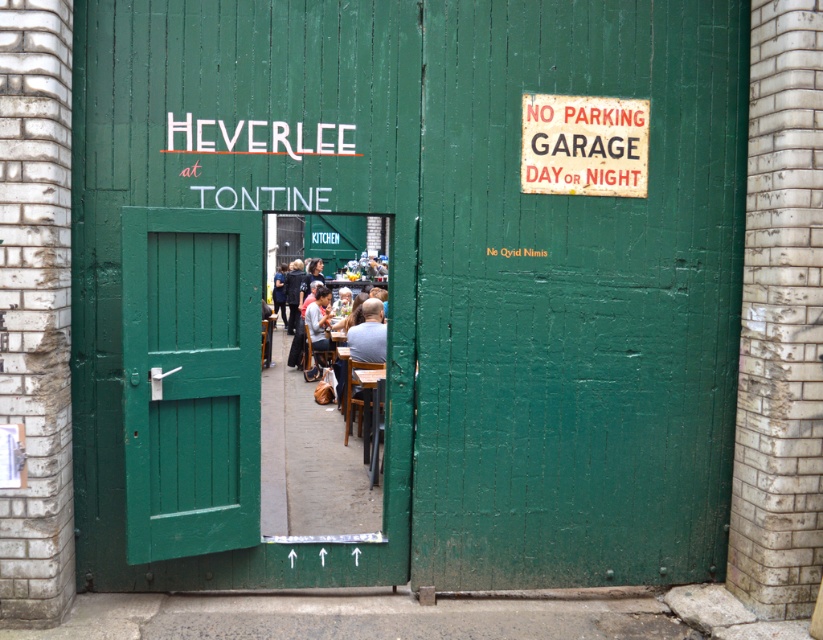
You are standing in front of the green wooden door at center and want to read the metallic rectangular sign at upper right. Which direction should you move to face the sign?

The green wooden door at center is positioned on the left side of the metallic rectangular sign at upper right, so you should move to your right to face the sign.

Consider the image. You are standing outside the green wooden door at center and want to enter the building. However, there is a metallic rectangular sign at upper right nearby. Can you walk straight towards the door without passing by the sign?

The green wooden door at center is in front of the metallic rectangular sign at upper right, meaning the sign is behind the door from your perspective. Therefore, you can walk straight towards the door without passing by the sign.